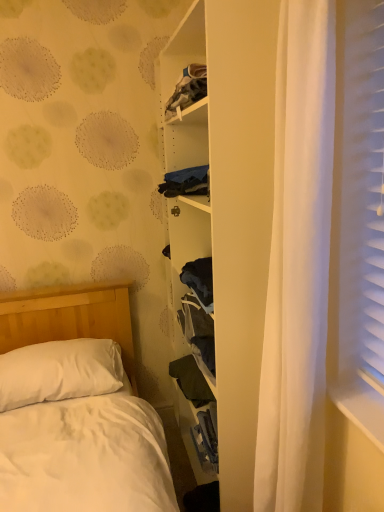
Question: Does white soft pillow at lower left turn towards white matte bookshelf at center?

Choices:
 (A) no
 (B) yes

Answer: (A)

Question: Considering the relative positions of white soft pillow at lower left and white matte bookshelf at center in the image provided, is white soft pillow at lower left to the right of white matte bookshelf at center from the viewer's perspective?

Choices:
 (A) yes
 (B) no

Answer: (B)

Question: Is white soft pillow at lower left closer to camera compared to white matte bookshelf at center?

Choices:
 (A) no
 (B) yes

Answer: (A)

Question: From the image's perspective, is white soft pillow at lower left under white matte bookshelf at center?

Choices:
 (A) no
 (B) yes

Answer: (B)

Question: Are white soft pillow at lower left and white matte bookshelf at center making contact?

Choices:
 (A) no
 (B) yes

Answer: (A)

Question: From the image's perspective, would you say white soft pillow at lower left is positioned over white matte bookshelf at center?

Choices:
 (A) yes
 (B) no

Answer: (B)

Question: From the image's perspective, is dark green fabric at center located above white matte bookshelf at center?

Choices:
 (A) yes
 (B) no

Answer: (B)

Question: Is the position of dark green fabric at center more distant than that of white matte bookshelf at center?

Choices:
 (A) no
 (B) yes

Answer: (B)

Question: Is dark green fabric at center to the right of white matte bookshelf at center from the viewer's perspective?

Choices:
 (A) yes
 (B) no

Answer: (B)

Question: Is dark green fabric at center surrounding white matte bookshelf at center?

Choices:
 (A) yes
 (B) no

Answer: (B)

Question: From a real-world perspective, is dark green fabric at center physically above white matte bookshelf at center?

Choices:
 (A) no
 (B) yes

Answer: (A)

Question: Considering the relative sizes of dark green fabric at center and white matte bookshelf at center in the image provided, is dark green fabric at center shorter than white matte bookshelf at center?

Choices:
 (A) yes
 (B) no

Answer: (A)

Question: Is white soft pillow at lower left completely or partially outside of dark green fabric at center?

Choices:
 (A) no
 (B) yes

Answer: (B)